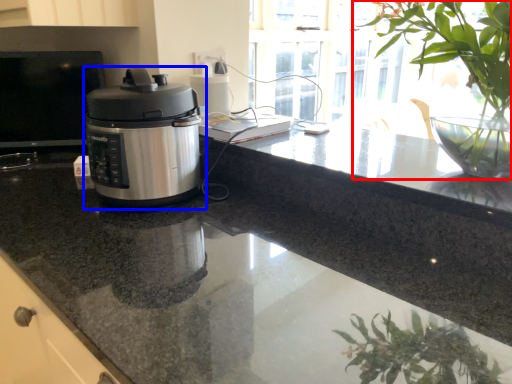
Question: Among these objects, which one is farthest to the camera, houseplant (highlighted by a red box) or home appliance (highlighted by a blue box)?

Choices:
 (A) houseplant
 (B) home appliance

Answer: (B)